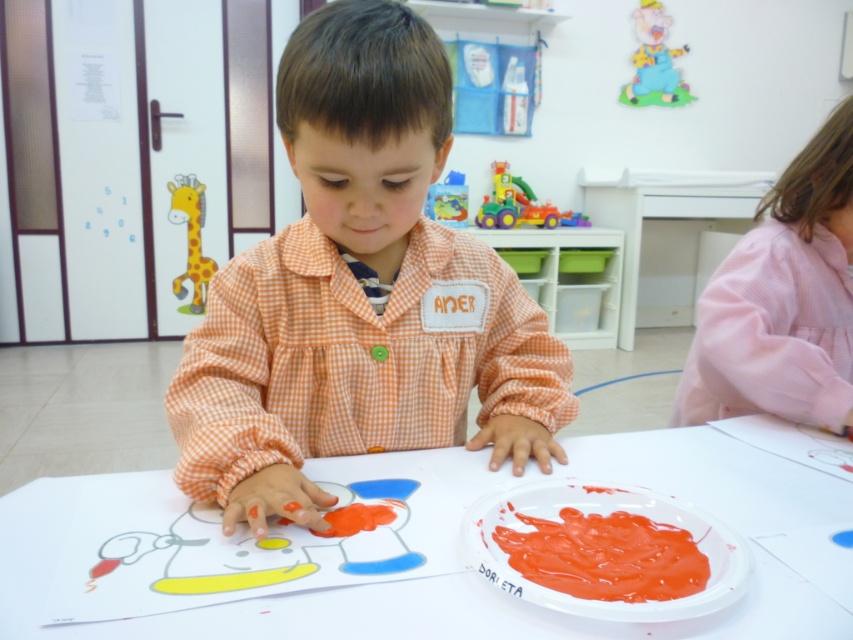
Question: Can you confirm if orange checkered shirt at center is smaller than plastic multicolored toy truck at upper center?

Choices:
 (A) yes
 (B) no

Answer: (A)

Question: Does smooth plastic plate at lower center lie in front of translucent plastic bottle at upper center?

Choices:
 (A) yes
 (B) no

Answer: (A)

Question: Which is nearer to the smooth plastic plate at lower center?

Choices:
 (A) plastic multicolored toy truck at upper center
 (B) orange checkered shirt at center
 (C) translucent plastic bottle at upper center
 (D) white paper at center

Answer: (D)

Question: Which point is closer to the camera?

Choices:
 (A) white paper at center
 (B) cartoon pig at upper right

Answer: (A)

Question: Does white paper at center have a smaller size compared to cartoon giraffe at left?

Choices:
 (A) no
 (B) yes

Answer: (A)

Question: Which point is closer to the camera?

Choices:
 (A) white paper at center
 (B) plastic multicolored toy truck at upper center
 (C) translucent plastic bottle at upper center

Answer: (A)